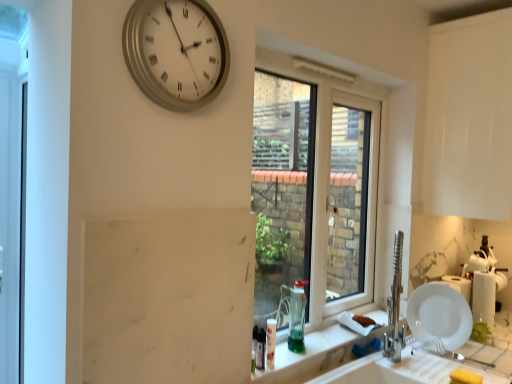
Question: Is green glass at lower center to the right of white glossy plate at lower right from the viewer's perspective?

Choices:
 (A) no
 (B) yes

Answer: (A)

Question: Does green glass at lower center have a lesser width compared to white glossy plate at lower right?

Choices:
 (A) no
 (B) yes

Answer: (A)

Question: Is green glass at lower center next to white glossy plate at lower right and touching it?

Choices:
 (A) no
 (B) yes

Answer: (A)

Question: Does green glass at lower center have a greater width compared to white glossy plate at lower right?

Choices:
 (A) no
 (B) yes

Answer: (B)

Question: From the image's perspective, is green glass at lower center on top of white glossy plate at lower right?

Choices:
 (A) no
 (B) yes

Answer: (A)

Question: Is green glass at lower center taller or shorter than white glossy plate at lower right?

Choices:
 (A) short
 (B) tall

Answer: (A)

Question: Choose the correct answer: Is green glass at lower center inside white glossy plate at lower right or outside it?

Choices:
 (A) inside
 (B) outside

Answer: (B)

Question: In terms of width, does green glass at lower center look wider or thinner when compared to white glossy plate at lower right?

Choices:
 (A) wide
 (B) thin

Answer: (A)

Question: From the image's perspective, is green glass at lower center positioned above or below white glossy plate at lower right?

Choices:
 (A) below
 (B) above

Answer: (A)

Question: Visually, is silver metallic clock at upper center positioned to the left or to the right of white glossy plate at lower right?

Choices:
 (A) right
 (B) left

Answer: (B)

Question: Considering the positions of silver metallic clock at upper center and white glossy plate at lower right in the image, is silver metallic clock at upper center taller or shorter than white glossy plate at lower right?

Choices:
 (A) tall
 (B) short

Answer: (A)

Question: Looking at the image, does silver metallic clock at upper center seem bigger or smaller compared to white glossy plate at lower right?

Choices:
 (A) big
 (B) small

Answer: (A)

Question: Is silver metallic clock at upper center inside the boundaries of white glossy plate at lower right, or outside?

Choices:
 (A) inside
 (B) outside

Answer: (B)

Question: Based on their positions, is green glass at lower center located to the left or right of white plastic window at center?

Choices:
 (A) left
 (B) right

Answer: (A)

Question: Is point (313, 372) closer or farther from the camera than point (311, 91)?

Choices:
 (A) farther
 (B) closer

Answer: (B)